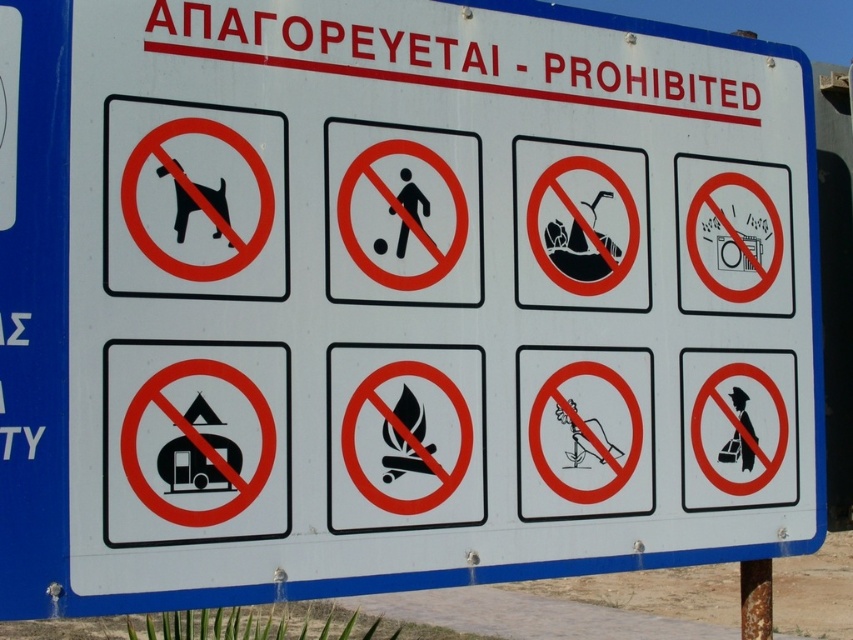
Based on the photo, which prohibition symbol is located at the coordinates point (194, 198)?

The point (194, 198) is located on the black plastic dog at upper left prohibition symbol.

You are looking at a signboard with two prohibited items. The black plastic dog at upper left and the black plastic soccer ball at center are both shown. Which prohibited item is larger in size?

The black plastic dog at upper left is bigger than the black plastic soccer ball at center.